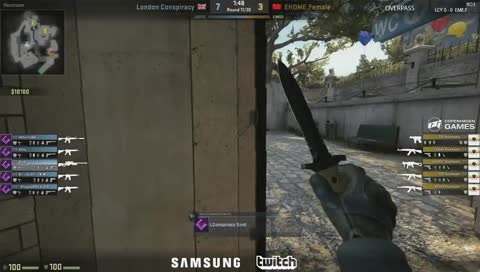
The image size is (480, 272). I want to click on place to sit, so click(372, 140).